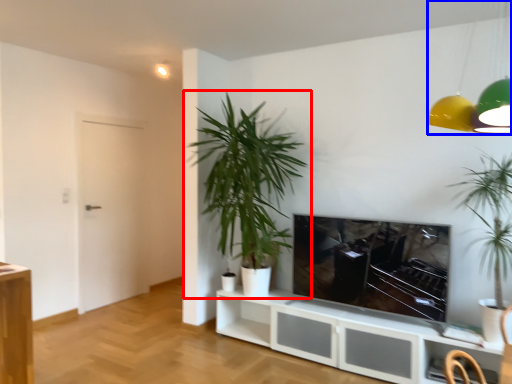
Question: Among these objects, which one is farthest to the camera, houseplant (highlighted by a red box) or lamp (highlighted by a blue box)?

Choices:
 (A) houseplant
 (B) lamp

Answer: (A)